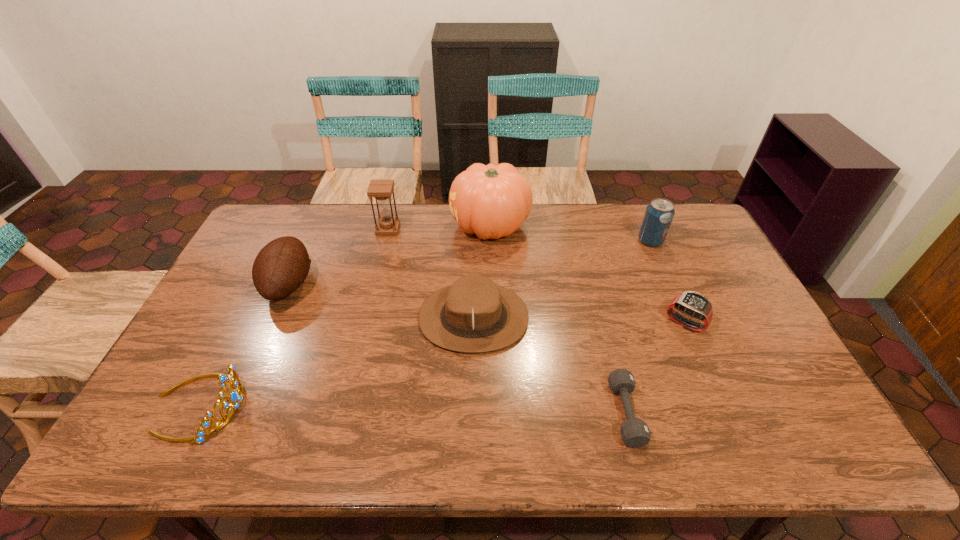
Locate an element on the screen. The width and height of the screenshot is (960, 540). hourglass positioned at the far edge is located at coordinates (381, 190).

Where is `pop soda present at the far edge`? pop soda present at the far edge is located at coordinates (659, 214).

Locate an element on the screen. This screenshot has height=540, width=960. tiara that is at the near edge is located at coordinates (235, 396).

Locate an element on the screen. dumbbell situated at the near edge is located at coordinates (635, 433).

Where is `football at the left edge`? football at the left edge is located at coordinates (282, 265).

Find the location of `tiara that is at the left edge`. tiara that is at the left edge is located at coordinates (235, 396).

What are the coordinates of `object that is at the right edge` in the screenshot? It's located at (693, 304).

This screenshot has width=960, height=540. Identify the location of object situated at the near left corner. (235, 396).

The image size is (960, 540). I want to click on free space at the far edge, so click(564, 242).

This screenshot has height=540, width=960. In the image, there is a desktop. Find the location of `blank space at the near edge`. blank space at the near edge is located at coordinates (569, 428).